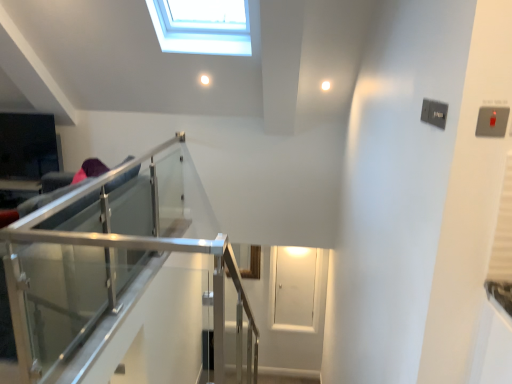
Question: From a real-world perspective, does transparent glass door at center sit lower than clear glass railing at left?

Choices:
 (A) no
 (B) yes

Answer: (B)

Question: Can you confirm if transparent glass door at center is wider than clear glass railing at left?

Choices:
 (A) no
 (B) yes

Answer: (A)

Question: Does transparent glass door at center come in front of clear glass railing at left?

Choices:
 (A) yes
 (B) no

Answer: (B)

Question: Can you confirm if transparent glass door at center is bigger than clear glass railing at left?

Choices:
 (A) no
 (B) yes

Answer: (A)

Question: Is clear glass railing at left completely or partially inside transparent glass door at center?

Choices:
 (A) no
 (B) yes

Answer: (A)

Question: Is transparent glass door at center outside of clear glass railing at left?

Choices:
 (A) no
 (B) yes

Answer: (B)

Question: Does clear glass railing at left lie in front of transparent glass door at center?

Choices:
 (A) no
 (B) yes

Answer: (B)

Question: Can you confirm if clear glass railing at left is wider than transparent glass door at center?

Choices:
 (A) no
 (B) yes

Answer: (B)

Question: Is clear glass railing at left positioned with its back to transparent glass door at center?

Choices:
 (A) no
 (B) yes

Answer: (A)

Question: Is clear glass railing at left placed right next to transparent glass door at center?

Choices:
 (A) no
 (B) yes

Answer: (A)

Question: From the image's perspective, is clear glass railing at left above transparent glass door at center?

Choices:
 (A) yes
 (B) no

Answer: (A)

Question: Does clear glass railing at left turn towards transparent glass door at center?

Choices:
 (A) no
 (B) yes

Answer: (A)

Question: From a real-world perspective, is transparent glass door at center above or below clear glass railing at left?

Choices:
 (A) above
 (B) below

Answer: (B)